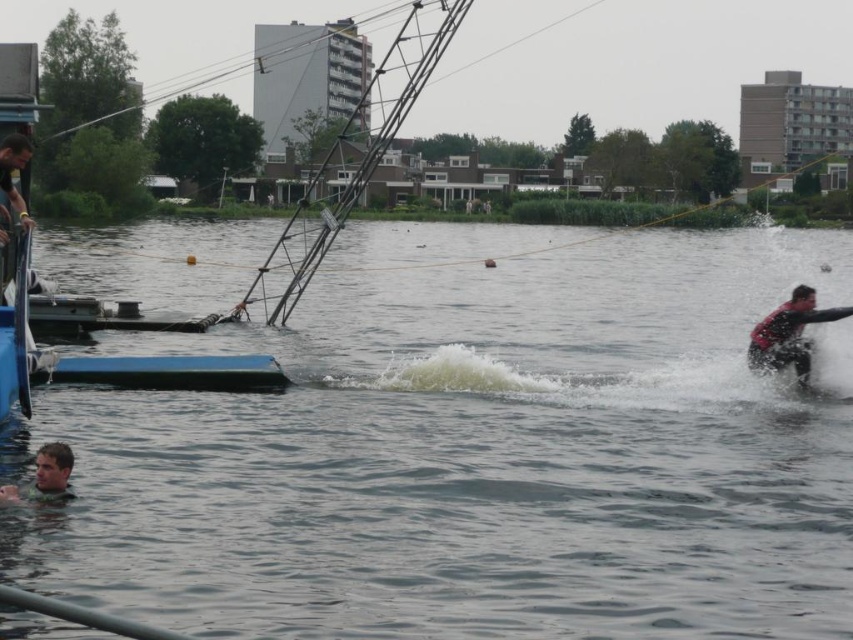
Is blue plastic boat at left behind red matte life vest at right?

No, blue plastic boat at left is in front of red matte life vest at right.

Is blue plastic boat at left to the right of red matte life vest at right from the viewer's perspective?

In fact, blue plastic boat at left is to the left of red matte life vest at right.

Does point (33, 371) come farther from viewer compared to point (758, 355)?

No.

This screenshot has height=640, width=853. Find the location of `blue plastic boat at left`. blue plastic boat at left is located at coordinates (357, 156).

Does clear water at lower left have a greater height compared to red matte life vest at right?

Indeed, clear water at lower left has a greater height compared to red matte life vest at right.

Can you confirm if clear water at lower left is wider than red matte life vest at right?

Correct, the width of clear water at lower left exceeds that of red matte life vest at right.

Which is in front, point (196, 604) or point (815, 310)?

Point (196, 604) is in front.

Where is `clear water at lower left`? The image size is (853, 640). clear water at lower left is located at coordinates (474, 452).

Does clear water at lower left have a greater height compared to smooth skin head at lower left?

Correct, clear water at lower left is much taller as smooth skin head at lower left.

Can you confirm if clear water at lower left is positioned to the left of smooth skin head at lower left?

In fact, clear water at lower left is to the right of smooth skin head at lower left.

Where is `clear water at lower left`? This screenshot has height=640, width=853. clear water at lower left is located at coordinates (474, 452).